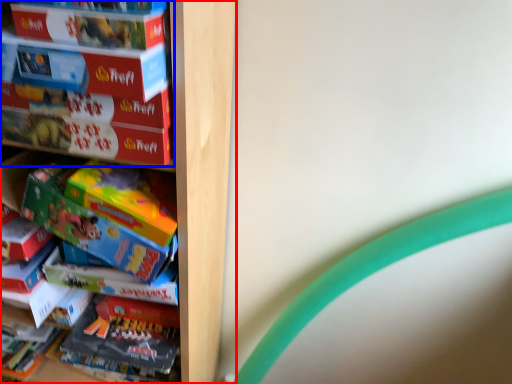
Question: Among these objects, which one is farthest to the camera, shelf (highlighted by a red box) or book (highlighted by a blue box)?

Choices:
 (A) shelf
 (B) book

Answer: (A)